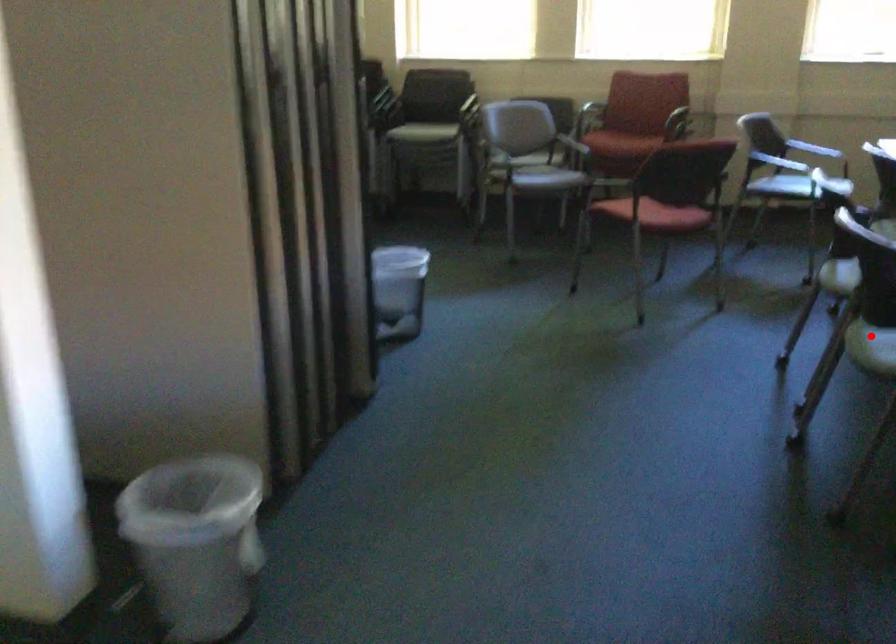
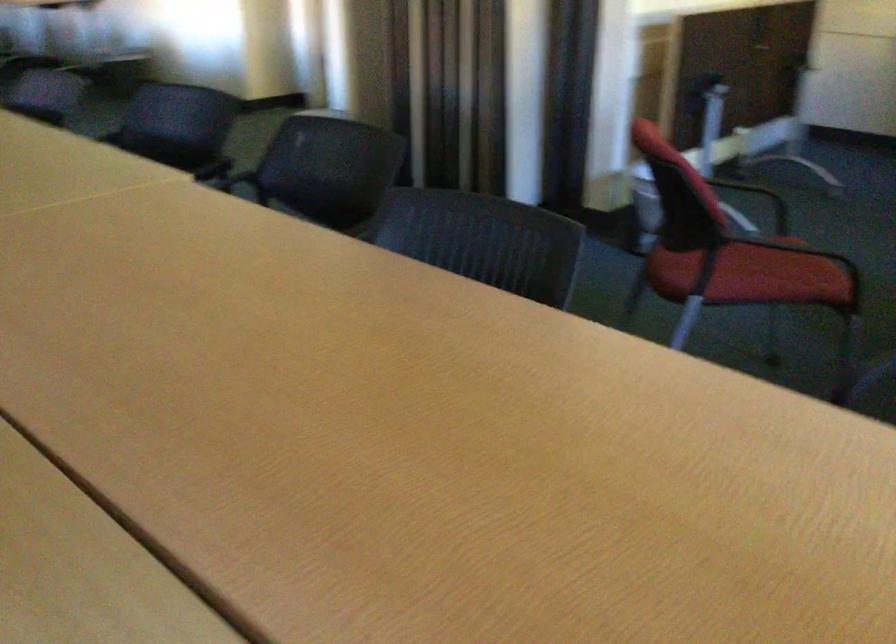
Question: I am providing you with two images of the same scene from different viewpoints. A red point is marked on the first image. Is the red point's position out of view in image 2?

Choices:
 (A) Yes
 (B) No

Answer: (A)